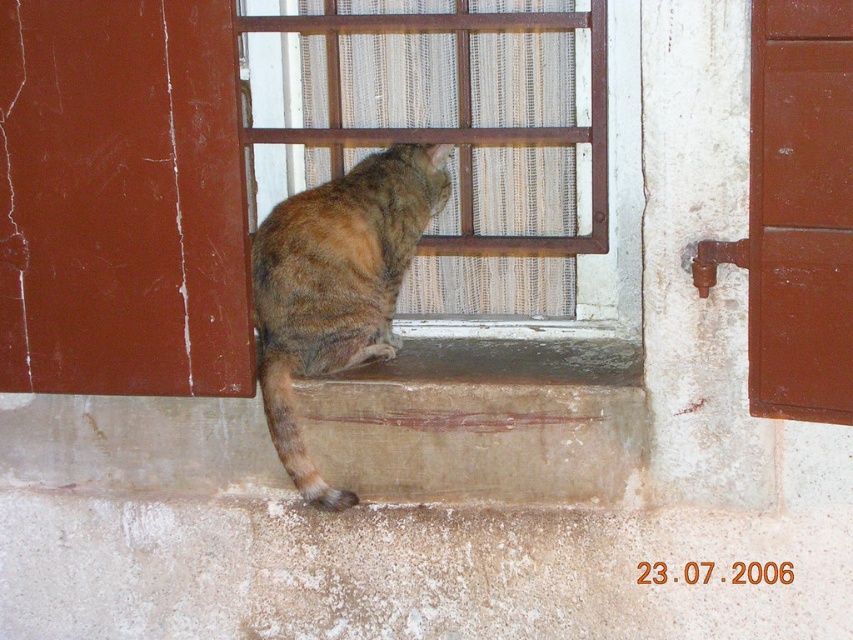
You are a delivery person trying to place a package on the windowsill where the tabby fur cat at lower center is sitting. The package is the size of the brown woven fabric at center. Will the package fit in the space where the cat is currently sitting?

The brown woven fabric at center has a smaller size compared to the tabby fur cat at lower center, so the package will fit in the space where the cat is sitting since it is smaller than the cat.

You are a cat owner who wants to place a new mat for your cat. The mat you have is the size of the brown woven fabric at center. Can the mat fit under the tabby fur cat at lower center without overlapping?

The brown woven fabric at center is wider than the tabby fur cat at lower center, so the mat can fit under the tabby fur cat at lower center without overlapping.

You are a drone trying to deliver a package to a point behind the window shutters. The window shutters are closed, but there are two points marked on the window frame. The first point is at coordinates point (415, 54), and the second point is at coordinates point (305, 374). Which of these points is located behind the closed window shutters?

Point (415, 54) is behind point (305, 374), so the point located behind the closed window shutters is point (415, 54).